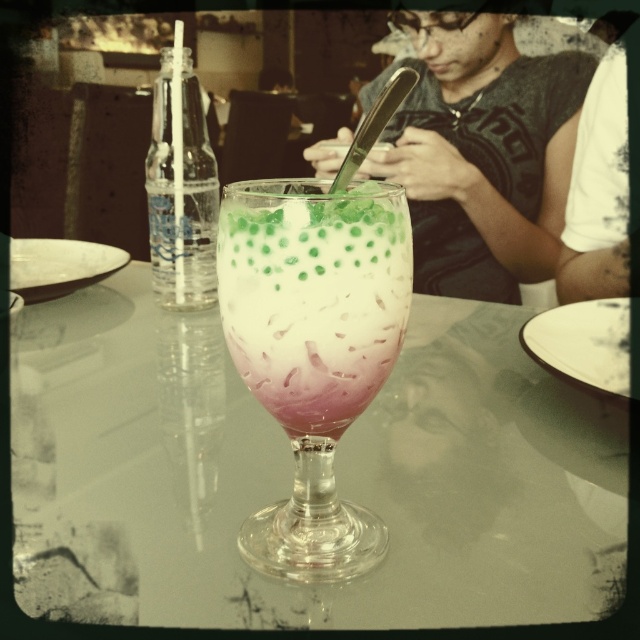
Question: Can you confirm if transparent glass table at center is bigger than clear glass bottle at left?

Choices:
 (A) no
 (B) yes

Answer: (B)

Question: Which object is closer to the camera taking this photo?

Choices:
 (A) clear glass bottle at left
 (B) pink frosted glass at center

Answer: (B)

Question: Which object appears closest to the camera in this image?

Choices:
 (A) clear glass bottle at left
 (B) pink frosted glass at center
 (C) dark gray shirt at center
 (D) transparent glass table at center

Answer: (B)

Question: Which point is farther from the camera taking this photo?

Choices:
 (A) [358, 387]
 (B) [253, 509]
 (C) [477, 26]
 (D) [209, 243]

Answer: (C)

Question: From the image, what is the correct spatial relationship of transparent glass table at center in relation to dark gray shirt at center?

Choices:
 (A) left
 (B) right

Answer: (A)

Question: Observing the image, what is the correct spatial positioning of dark gray shirt at center in reference to clear plastic bottle at left?

Choices:
 (A) above
 (B) below

Answer: (A)